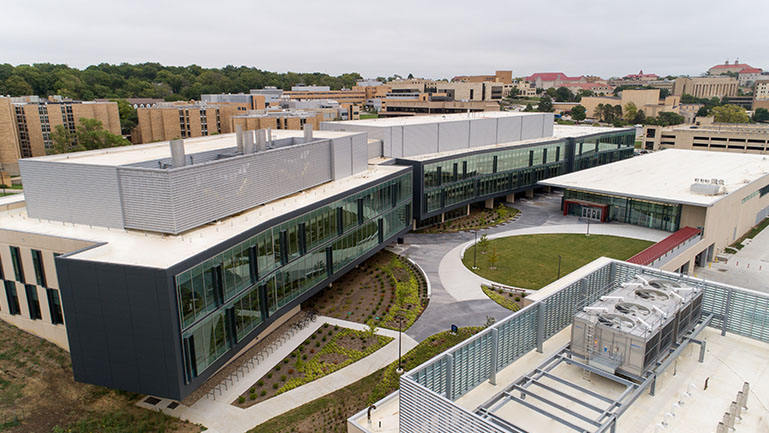
The height and width of the screenshot is (433, 769). Find the location of `doors`. doors is located at coordinates (591, 211).